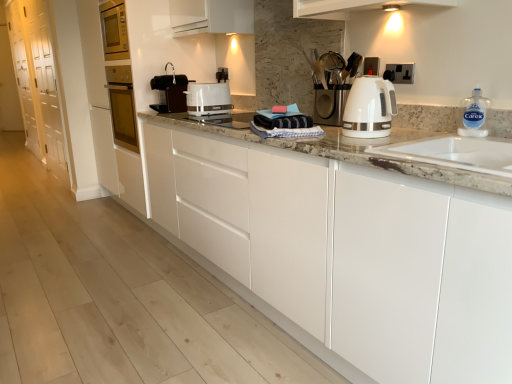
At what (x,y) coordinates should I click in order to perform the action: click on vacant space underneath black plastic coffee machine at center, which ranks as the first home appliance in top-to-bottom order (from a real-world perspective). Please return your answer as a coordinate pair (x, y). Looking at the image, I should click on (161, 112).